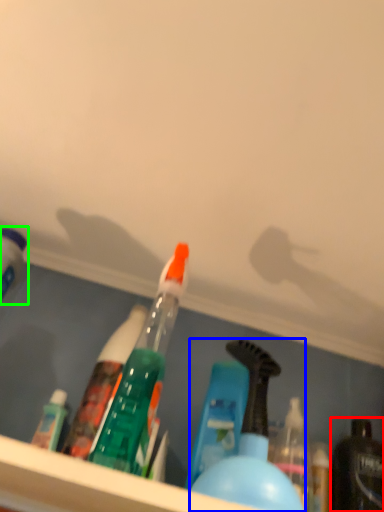
Question: Considering the real-world distances, which object is closest to bottle (highlighted by a red box)? bottle (highlighted by a blue box) or bottle (highlighted by a green box).

Choices:
 (A) bottle
 (B) bottle

Answer: (A)